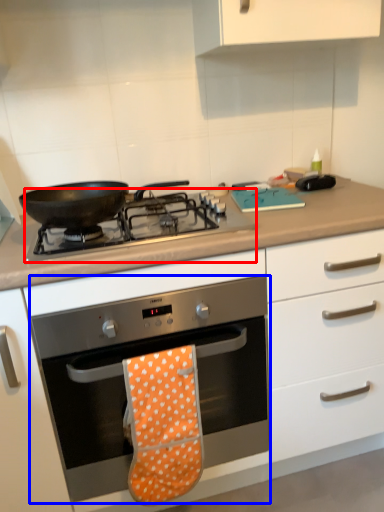
Question: Which object is further to the camera taking this photo, gas stove (highlighted by a red box) or oven (highlighted by a blue box)?

Choices:
 (A) gas stove
 (B) oven

Answer: (A)